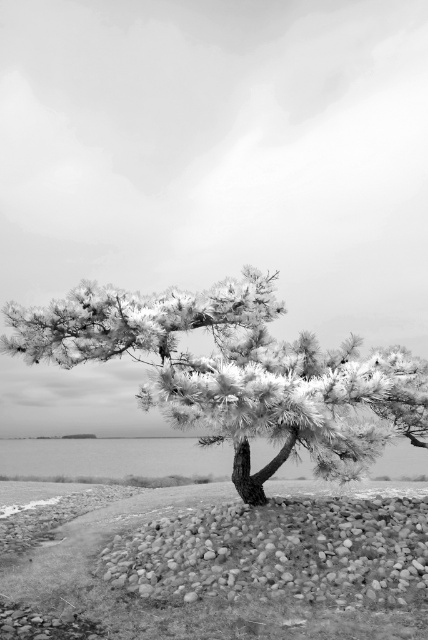
You are standing at the center of the image and want to place a decorative stone exactly at the same position as the frosty pine tree at center. What are the coordinates where you should place the stone?

The frosty pine tree at center is located at point (237, 372), so you should place the decorative stone at those coordinates to match its position.

You are a photographer standing at the edge of the water. You want to capture a photo of the frosty pine tree at center and the transparent water at center. Based on their positions, which object is closer to you?

The frosty pine tree at center is located above transparent water at center, so the transparent water at center is closer to you.

You are standing in the scene and want to place a small statue exactly between the frosty pine tree at center and the smooth pebbles at center. According to the scene description, which object should the statue be closer to?

The statue should be closer to the smooth pebbles at center because the frosty pine tree at center is positioned to the left of the smooth pebbles at center.